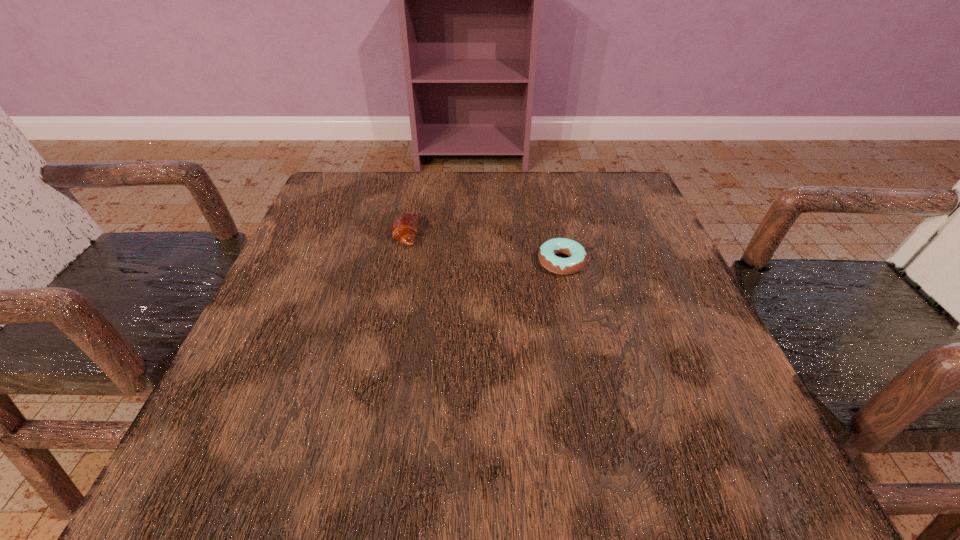
Where is `free region at the near left corner of the desktop`? Image resolution: width=960 pixels, height=540 pixels. free region at the near left corner of the desktop is located at coordinates (209, 444).

In the image, there is a desktop. Identify the location of vacant space at the far right corner. The image size is (960, 540). (637, 225).

Image resolution: width=960 pixels, height=540 pixels. What are the coordinates of `vacant space that satisfies the following two spatial constraints: 1. on the front side of the right object; 2. on the left side of the left object` in the screenshot? It's located at (399, 262).